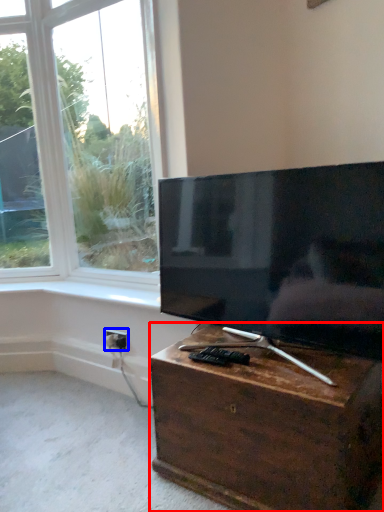
Question: Which object appears farthest to the camera in this image, nightstand (highlighted by a red box) or electric outlet (highlighted by a blue box)?

Choices:
 (A) nightstand
 (B) electric outlet

Answer: (B)